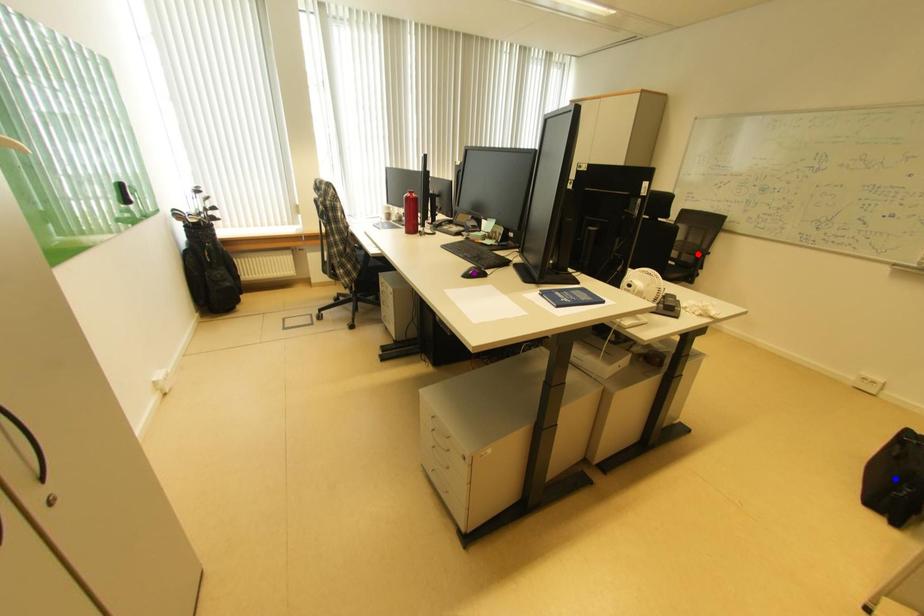
Order these from farthest to nearest:
purple point, blue point, red point

red point < purple point < blue point